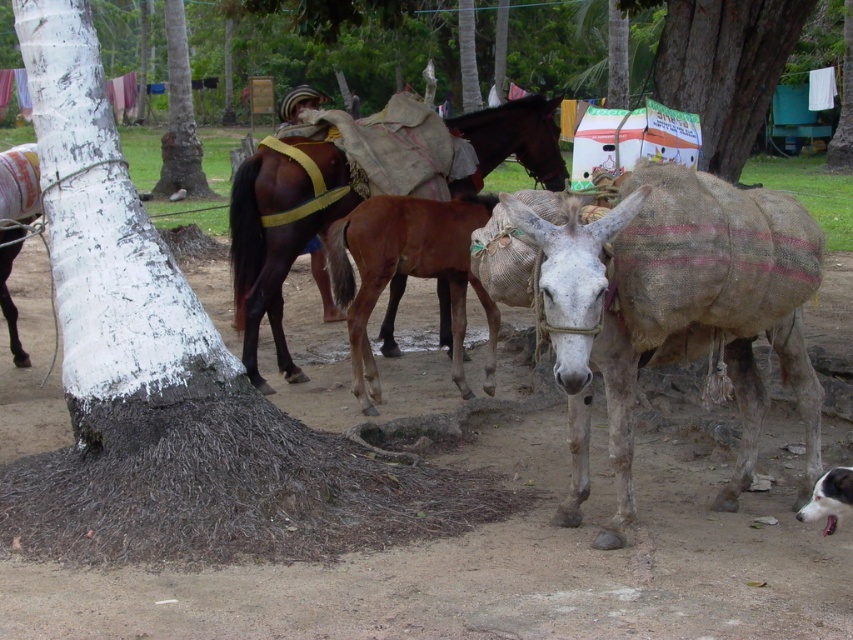
You are a hiker who wants to distinguish between the white painted bark at center left and the white fur dog at lower right in the scene. Which one is bigger?

The white painted bark at center left is larger in size than the white fur dog at lower right.

You are standing at a point in the scene and want to know how far you are from the camera. The coordinates of your position are point (339, 216). Can you determine the distance?

The distance between point (339, 216) and the camera is 7.36 meters.